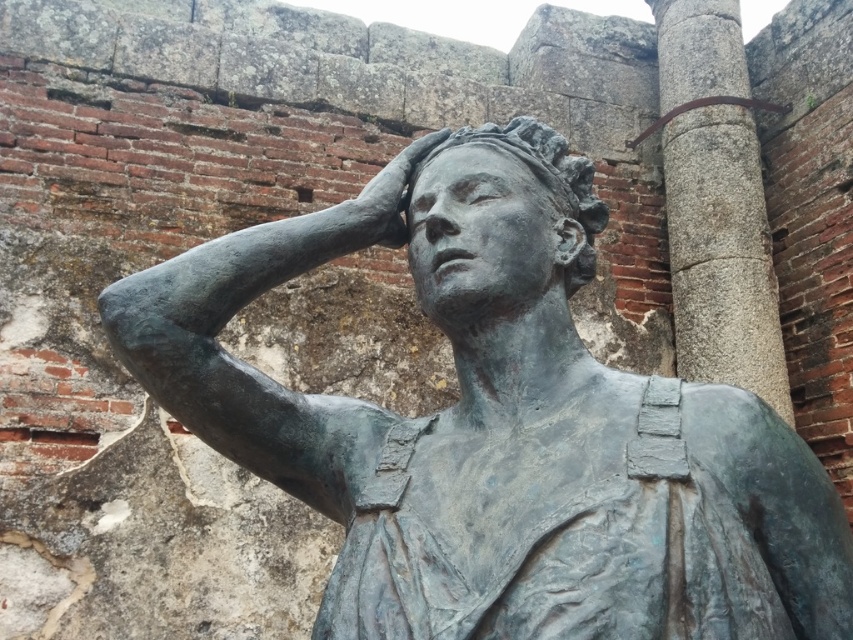
Question: Is bronze statue at center to the right of bronze hand at center from the viewer's perspective?

Choices:
 (A) no
 (B) yes

Answer: (B)

Question: Which point is farther from the camera taking this photo?

Choices:
 (A) (442, 144)
 (B) (393, 232)

Answer: (A)

Question: Which object appears closest to the camera in this image?

Choices:
 (A) bronze statue head at center
 (B) bronze statue at center

Answer: (B)

Question: Is gray stone column at upper right closer to the viewer compared to bronze statue head at center?

Choices:
 (A) yes
 (B) no

Answer: (B)

Question: Estimate the real-world distances between objects in this image. Which object is closer to the bronze statue at center?

Choices:
 (A) bronze hand at center
 (B) gray stone column at upper right
 (C) bronze statue head at center

Answer: (C)

Question: Is bronze statue at center to the right of gray stone column at upper right from the viewer's perspective?

Choices:
 (A) no
 (B) yes

Answer: (A)